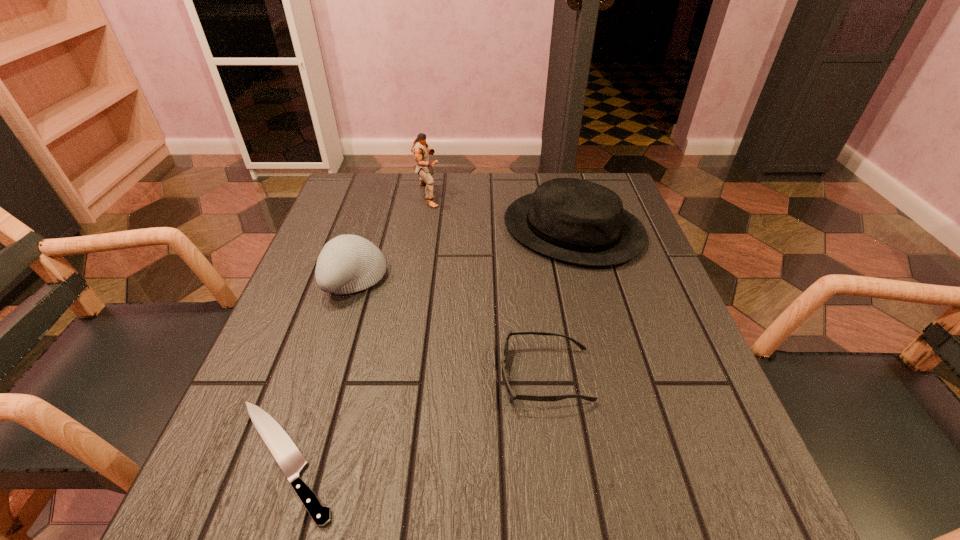
At what (x,y) coordinates should I click in order to perform the action: click on the third object from right to left. Please return your answer as a coordinate pair (x, y). Looking at the image, I should click on (420, 149).

Where is `the tallest object`? This screenshot has width=960, height=540. the tallest object is located at coordinates (420, 149).

Where is `fedora`? Image resolution: width=960 pixels, height=540 pixels. fedora is located at coordinates (573, 220).

You are a GUI agent. You are given a task and a screenshot of the screen. Output one action in this format:
    pyautogui.click(x=<x>, y=<y>)
    Task: Click on the beanie
    The width and height of the screenshot is (960, 540).
    Given the screenshot: What is the action you would take?
    pyautogui.click(x=347, y=264)

Locate an element on the screen. The width and height of the screenshot is (960, 540). the second shortest object is located at coordinates (511, 395).

Identify the location of steak knife. Image resolution: width=960 pixels, height=540 pixels. (x=290, y=459).

Where is `vacant region located on the front-facing side of the third object from left to right`? The height and width of the screenshot is (540, 960). vacant region located on the front-facing side of the third object from left to right is located at coordinates (585, 195).

The width and height of the screenshot is (960, 540). Identify the location of free space located on the left of the fedora. pyautogui.click(x=416, y=230).

This screenshot has width=960, height=540. What are the coordinates of `vacant space located 0.360m on the front of the beanie` in the screenshot? It's located at (290, 488).

Locate an element on the screen. This screenshot has height=540, width=960. vacant point located 0.360m on the front-facing side of the sunglasses is located at coordinates (x=295, y=376).